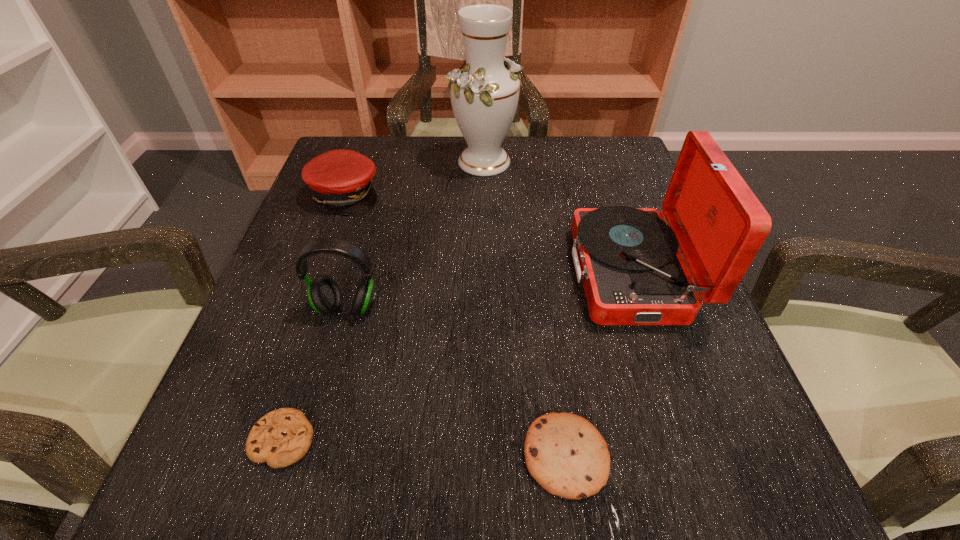
Find the location of `vase`. vase is located at coordinates (484, 95).

The image size is (960, 540). What are the coordinates of `phonograph_record` in the screenshot? It's located at (628, 260).

Locate an element on the screen. The height and width of the screenshot is (540, 960). the rightmost object is located at coordinates (628, 260).

You are a GUI agent. You are given a task and a screenshot of the screen. Output one action in this format:
    pyautogui.click(x=<x>, y=<y>)
    Task: Click on the third tallest object
    Image resolution: width=960 pixels, height=540 pixels.
    Given the screenshot: What is the action you would take?
    pyautogui.click(x=324, y=295)

At what (x,y) coordinates should I click in order to perform the action: click on the fourth tallest object. Please return your answer as a coordinate pair (x, y). This screenshot has height=540, width=960. Looking at the image, I should click on [341, 180].

Find the location of a particular element. The width and height of the screenshot is (960, 540). the taller cookie is located at coordinates (565, 453).

Where is `the right cookie`? The width and height of the screenshot is (960, 540). the right cookie is located at coordinates (565, 453).

Locate an element on the screen. This screenshot has width=960, height=540. the shorter cookie is located at coordinates (282, 437).

You are a GUI agent. You are given a task and a screenshot of the screen. Output one action in this format:
    pyautogui.click(x=<x>, y=<y>)
    Task: Click on the left cookie
    This screenshot has height=540, width=960.
    Given the screenshot: What is the action you would take?
    pyautogui.click(x=282, y=437)

The height and width of the screenshot is (540, 960). In order to click on free space located on the left of the tallest object in this screenshot , I will do `click(383, 162)`.